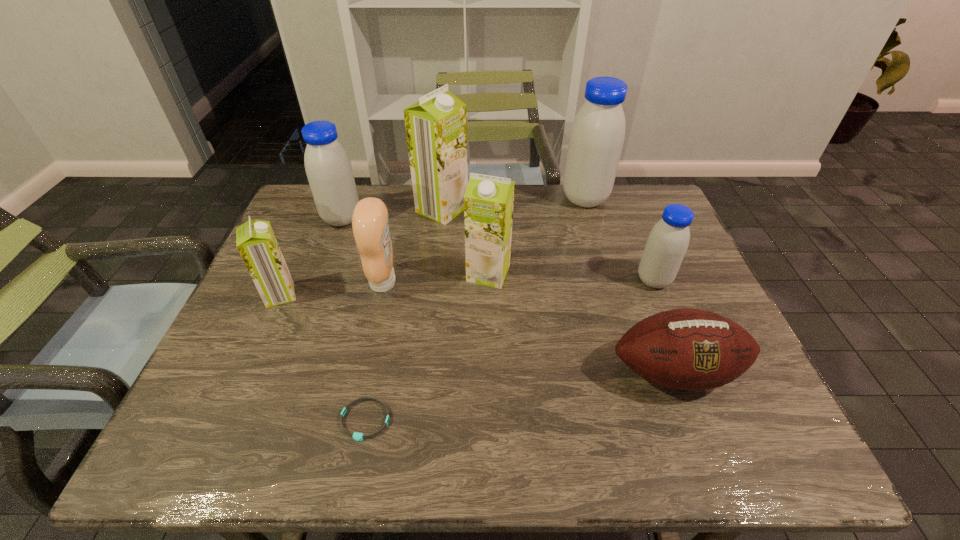
The height and width of the screenshot is (540, 960). Identify the location of the biggest blue soya milk. (597, 134).

At what (x,y) coordinates should I click in order to perform the action: click on the third soya milk from left to right. Please return your answer as a coordinate pair (x, y). Looking at the image, I should click on (436, 126).

You are a GUI agent. You are given a task and a screenshot of the screen. Output one action in this format:
    pyautogui.click(x=<x>, y=<y>)
    Task: Click on the biggest green soya milk
    
    Given the screenshot: What is the action you would take?
    pyautogui.click(x=436, y=126)

The height and width of the screenshot is (540, 960). Find the location of `the sixth object from left to right`. the sixth object from left to right is located at coordinates (488, 200).

At what (x,y) coordinates should I click in order to perform the action: click on the second biggest green soya milk. Please return your answer as a coordinate pair (x, y). Looking at the image, I should click on (488, 200).

Locate an element on the screen. This screenshot has width=960, height=540. the second biggest blue soya milk is located at coordinates (328, 168).

You are a GUI agent. You are given a task and a screenshot of the screen. Output one action in this format:
    pyautogui.click(x=<x>, y=<y>)
    Task: Click on the condiment
    
    Given the screenshot: What is the action you would take?
    pyautogui.click(x=370, y=226)

What are the coordinates of `the smallest blue soya milk` in the screenshot? It's located at (667, 243).

Locate an element on the screen. The image size is (960, 540). the leftmost green soya milk is located at coordinates (255, 240).

You are a GUI agent. You are given a task and a screenshot of the screen. Output one action in this format:
    pyautogui.click(x=<x>, y=<y>)
    Task: Click on the football (American)
    The height and width of the screenshot is (540, 960).
    Given the screenshot: What is the action you would take?
    pyautogui.click(x=687, y=349)